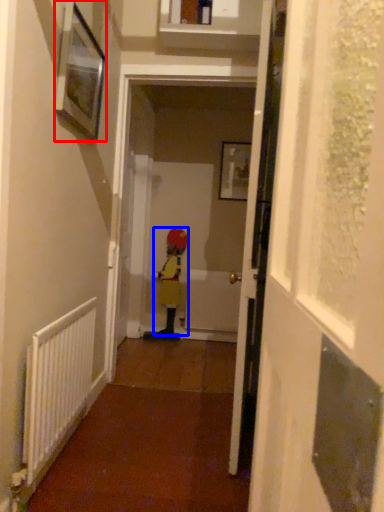
Question: Which object is closer to the camera taking this photo, picture frame (highlighted by a red box) or person (highlighted by a blue box)?

Choices:
 (A) picture frame
 (B) person

Answer: (A)